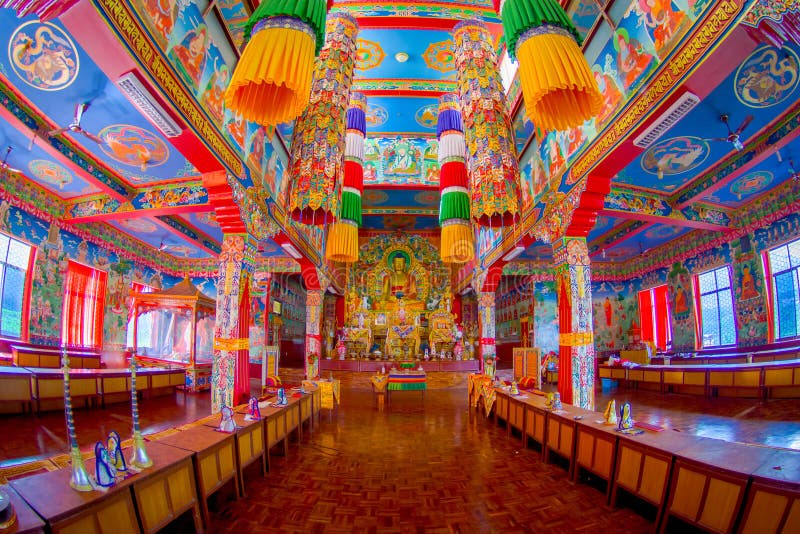
This screenshot has height=534, width=800. I want to click on vents, so click(x=656, y=133), click(x=153, y=107).